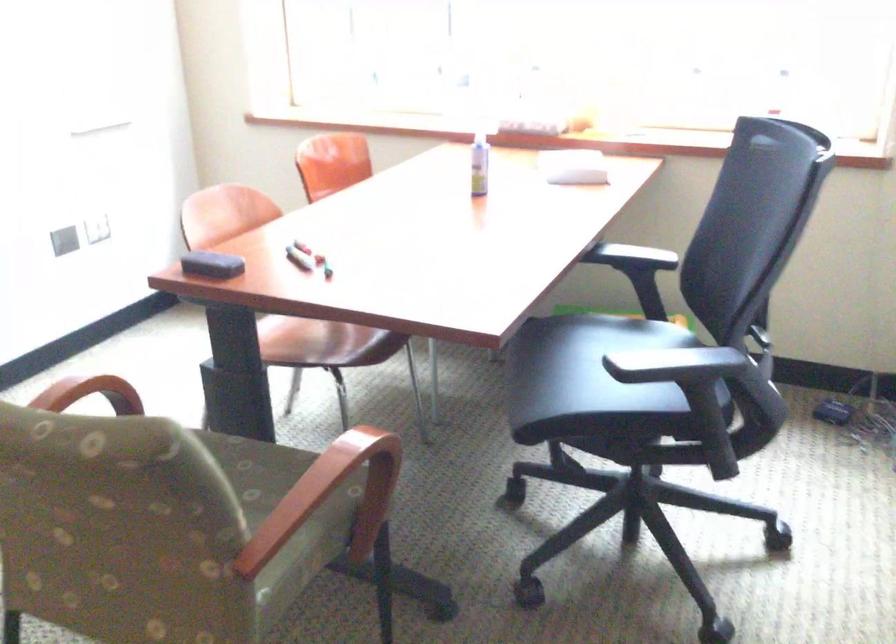
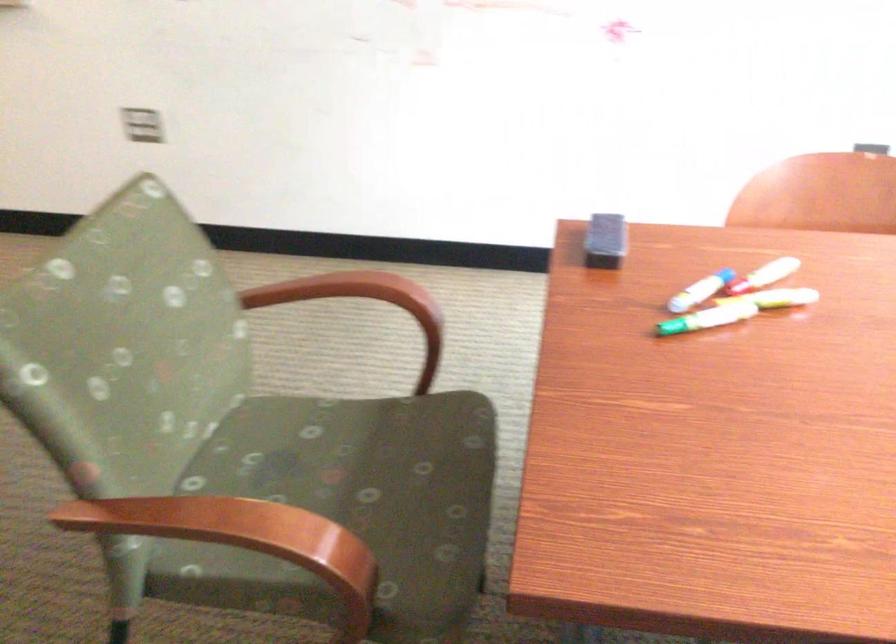
Question: I am providing you with two images of the same scene from different viewpoints. Which of the following objects are not visible in image2?

Choices:
 (A) orange chair sitting surface
 (B) small hand mirror
 (C) dry erase marker
 (D) wooden chair armrest

Answer: (A)